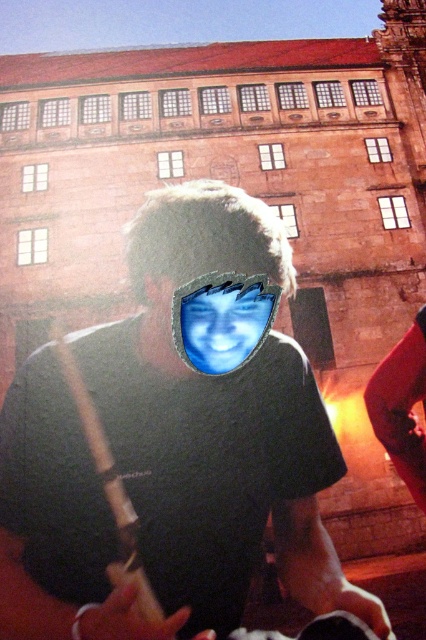
Is point (77, 576) in front of point (264, 326)?

Yes, point (77, 576) is in front of point (264, 326).

Is point (58, 568) farther from viewer compared to point (249, 323)?

No, it is not.

At what (x,y) coordinates should I click in order to perform the action: click on black matte shirt at center. Please return your answer as a coordinate pair (x, y). The image size is (426, 640). Looking at the image, I should click on (172, 449).